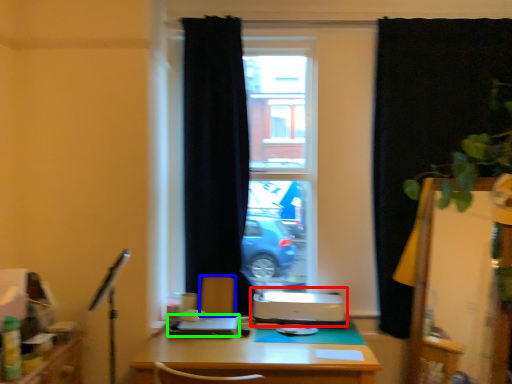
Question: Which object is positioned farthest from printer (highlighted by a red box)? Select from armchair (highlighted by a blue box) and laptop (highlighted by a green box).

Choices:
 (A) armchair
 (B) laptop

Answer: (B)